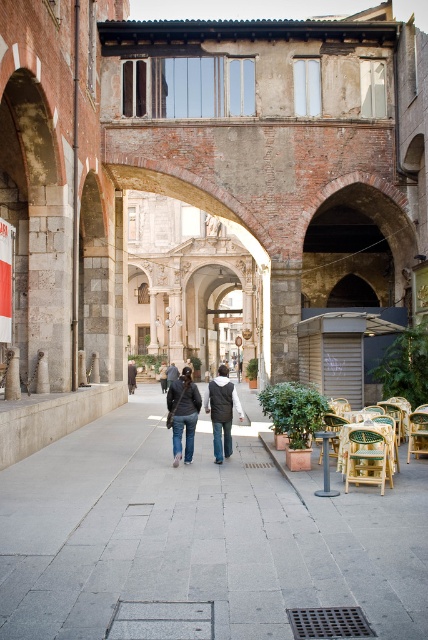
Question: Observing the image, what is the correct spatial positioning of denim jeans at center in reference to dark gray fabric jacket at center?

Choices:
 (A) below
 (B) above

Answer: (A)

Question: Which point appears closest to the camera in this image?

Choices:
 (A) (178, 372)
 (B) (137, 518)

Answer: (B)

Question: Is dark gray fabric jacket at center closer to camera compared to dark gray jacket at center?

Choices:
 (A) yes
 (B) no

Answer: (A)

Question: Where is gray concrete pavement at center located in relation to denim jacket at center in the image?

Choices:
 (A) right
 (B) left

Answer: (A)

Question: Which of the following is the farthest from the observer?

Choices:
 (A) (374, 445)
 (B) (190, 384)
 (C) (172, 374)
 (D) (169, 420)

Answer: (C)

Question: Among these objects, which one is farthest from the camera?

Choices:
 (A) denim jeans at center
 (B) gray concrete pavement at center
 (C) wooden chair at lower right

Answer: (A)